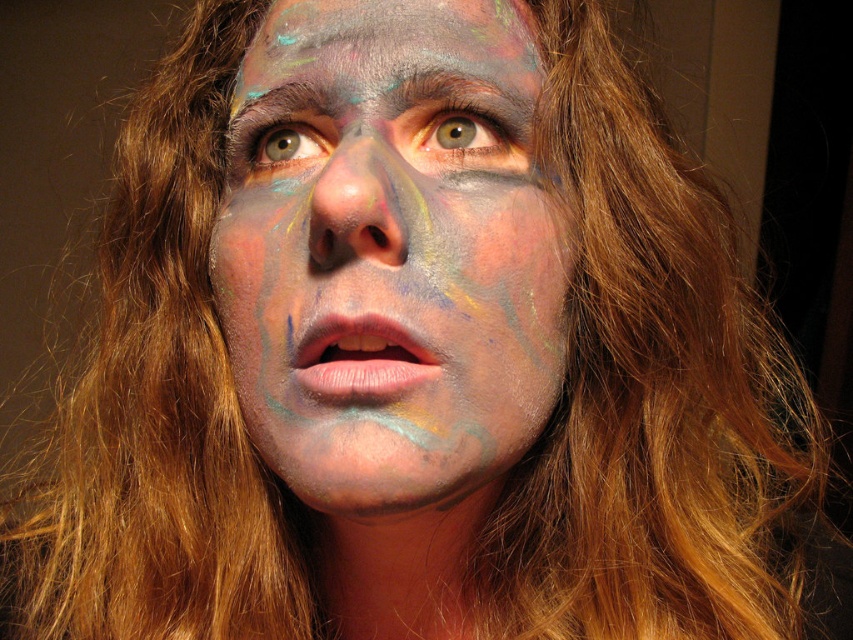
You are a makeup artist preparing to apply face paint to a client. You have both the multicolored paint at center and the matte multicolored face paint at center available. Which one should you use first to ensure proper application?

The multicolored paint at center should be applied first because it is in front of the matte multicolored face paint at center, meaning the matte paint would go over it to achieve the desired layered look.

Based on the scene description, which object is taller between the matte green eye at center and the matte multicolored face paint at center?

The matte green eye at center is much taller than the matte multicolored face paint at center according to the description.

You are a photographer adjusting your camera settings to focus on two specific points in the image. The points are labeled as point 1 at coordinates point (450, 140) and point 2 at coordinates point (305, 132). Which point should you focus on first if you want to ensure the closest point is in sharp focus?

Point 1 at coordinates point (450, 140) is closer to the camera than point 2 at coordinates point (305, 132), so you should focus on point 1 first to ensure the closest point is in sharp focus.